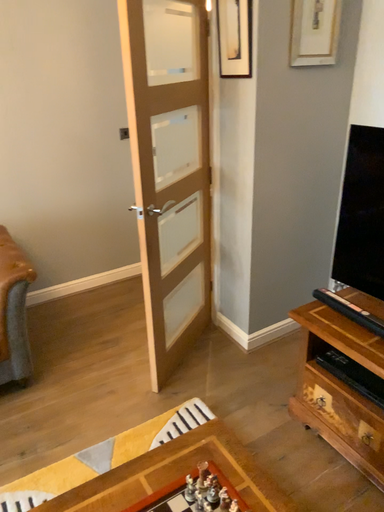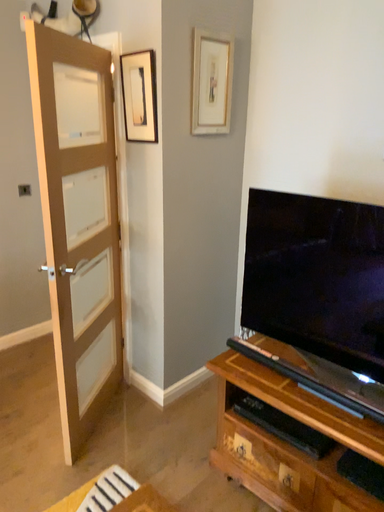
Question: Which way did the camera rotate in the video?

Choices:
 (A) rotated upward
 (B) rotated downward

Answer: (A)